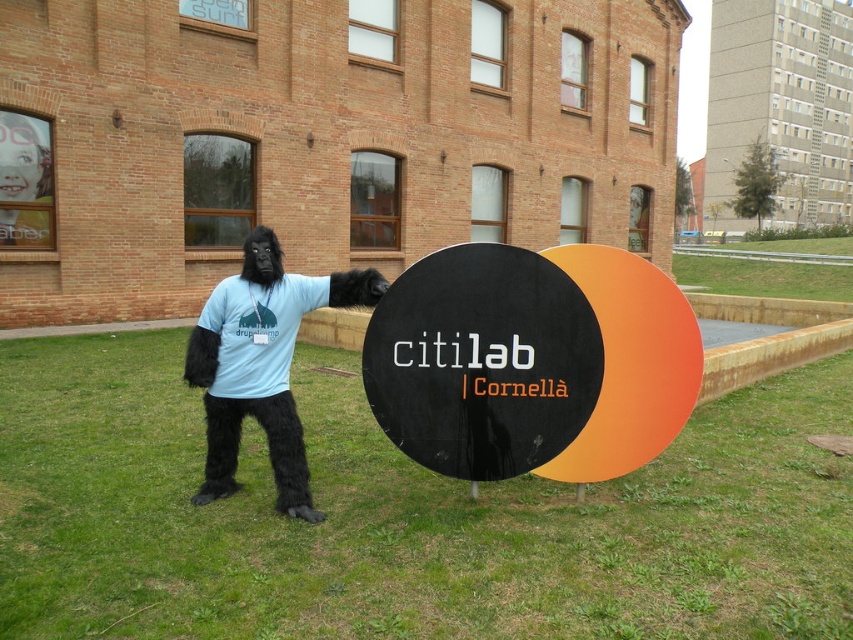
Where is `green grass at center`? green grass at center is located at coordinates (403, 516).

Is green grass at center wider than black matte sign at center?

Indeed, green grass at center has a greater width compared to black matte sign at center.

The image size is (853, 640). Describe the element at coordinates (403, 516) in the screenshot. I see `green grass at center` at that location.

Locate an element on the screen. This screenshot has height=640, width=853. green grass at center is located at coordinates (403, 516).

Between green grass at center and matte black gorilla suit at center, which one appears on the right side from the viewer's perspective?

green grass at center is more to the right.

Does point (521, 524) lie in front of point (3, 202)?

Yes, point (521, 524) is closer to viewer.

You are a GUI agent. You are given a task and a screenshot of the screen. Output one action in this format:
    pyautogui.click(x=<x>, y=<y>)
    Task: Click on the green grass at center
    The width and height of the screenshot is (853, 640).
    Given the screenshot: What is the action you would take?
    pyautogui.click(x=403, y=516)